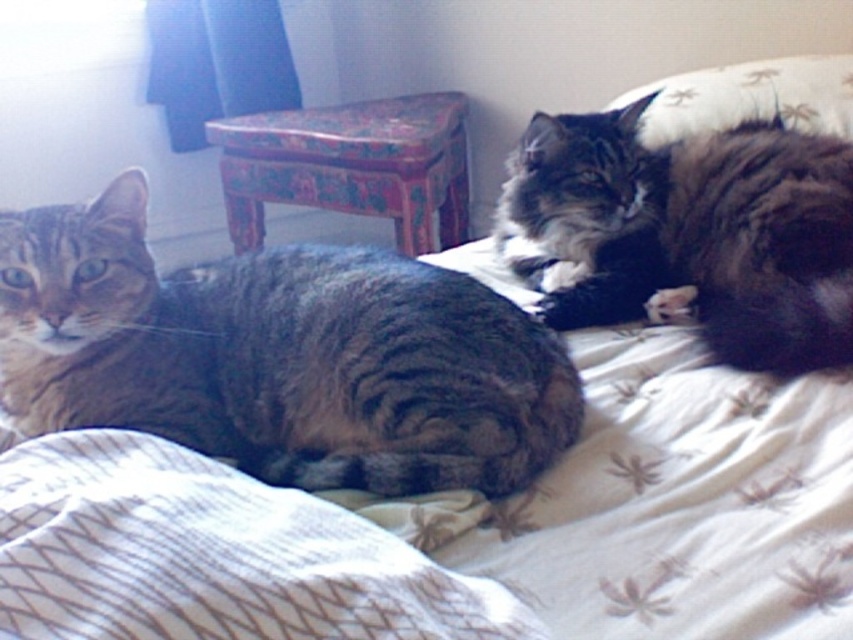
Is white textured blanket at lower left positioned behind dark brown fur at upper right?

No, it is in front of dark brown fur at upper right.

Can you confirm if white textured blanket at lower left is bigger than dark brown fur at upper right?

No, white textured blanket at lower left is not bigger than dark brown fur at upper right.

Identify the location of white textured blanket at lower left. (212, 556).

Between tabby fur cat at left and wooden painted stool at center, which one has more height?

wooden painted stool at center

Looking at this image, does tabby fur cat at left appear under wooden painted stool at center?

Yes.

Image resolution: width=853 pixels, height=640 pixels. What are the coordinates of `tabby fur cat at left` in the screenshot? It's located at (277, 355).

Where is `tabby fur cat at left`? tabby fur cat at left is located at coordinates (277, 355).

Is dark brown fur at upper right below wooden painted stool at center?

Yes, dark brown fur at upper right is below wooden painted stool at center.

Can you confirm if dark brown fur at upper right is wider than wooden painted stool at center?

In fact, dark brown fur at upper right might be narrower than wooden painted stool at center.

The width and height of the screenshot is (853, 640). Identify the location of dark brown fur at upper right. (692, 230).